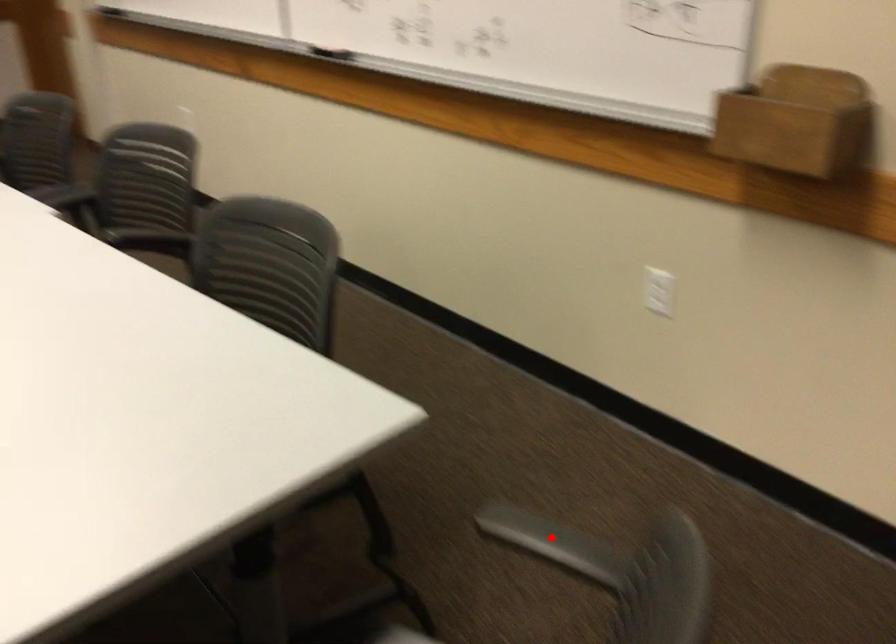
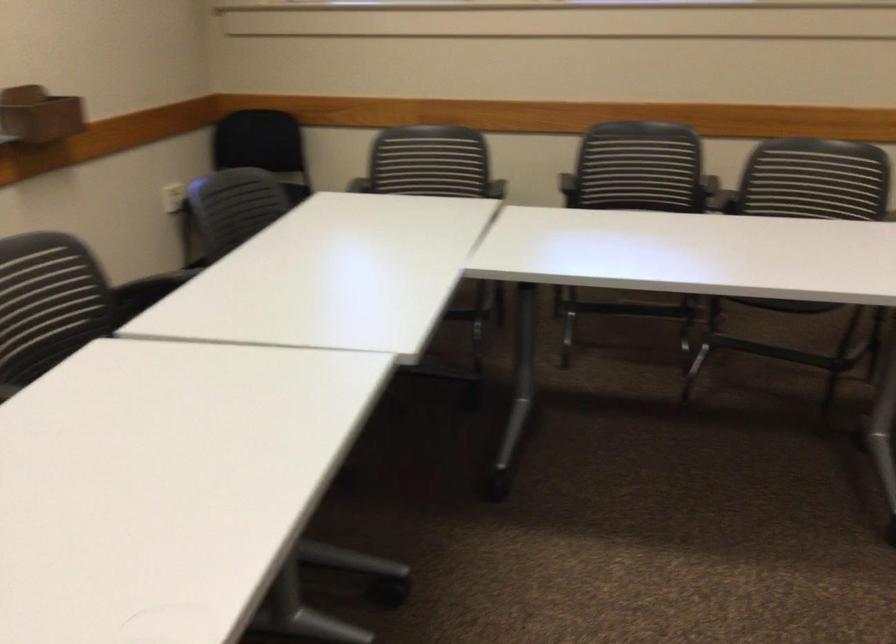
Question: I am providing you with two images of the same scene from different viewpoints. A red point is marked on the first image. Can you still see the location of the red point in image 2?

Choices:
 (A) Yes
 (B) No

Answer: (B)